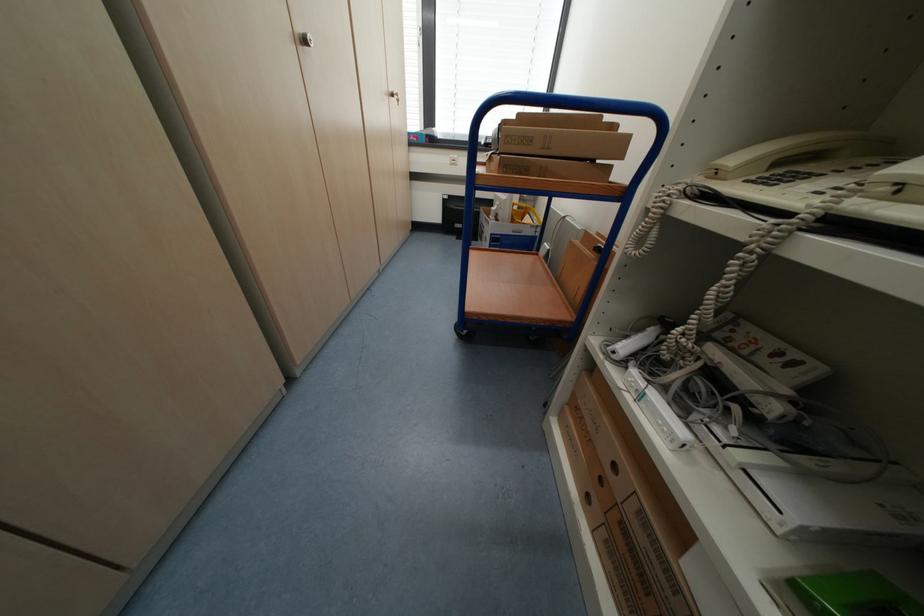
What do you see at coordinates (787, 147) in the screenshot? I see `the white telephone handset` at bounding box center [787, 147].